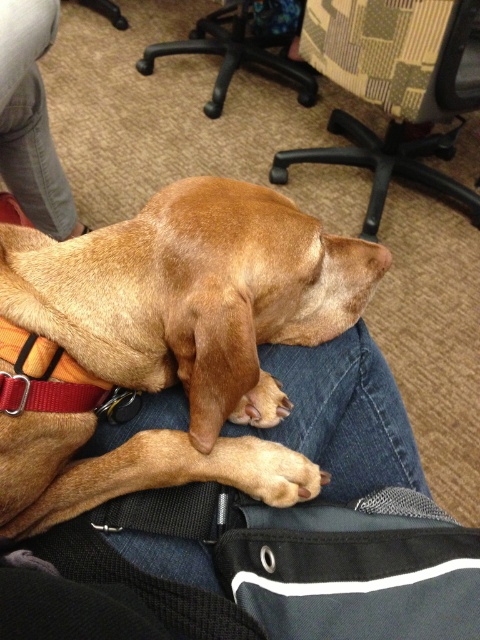
The height and width of the screenshot is (640, 480). Identify the location of patterned fabric chair at upper center. (393, 88).

Does patterned fabric chair at upper center have a lesser height compared to denim pants at lower left?

In fact, patterned fabric chair at upper center may be taller than denim pants at lower left.

Between point (436, 99) and point (23, 16), which one is positioned behind?

The point (436, 99) is more distant.

Locate an element on the screen. This screenshot has width=480, height=640. patterned fabric chair at upper center is located at coordinates (393, 88).

Is point (133, 472) positioned after point (50, 161)?

That is False.

Does brown fur dog at center have a greater height compared to denim pants at lower left?

Yes.

Measure the distance between point [266,305] and camera.

Point [266,305] is 24.54 inches from camera.

In order to click on brown fur dog at center in this screenshot , I will do `click(170, 342)`.

Can you confirm if denim pants at lower left is shorter than black plastic chair at upper center?

Yes, denim pants at lower left is shorter than black plastic chair at upper center.

Between denim pants at lower left and black plastic chair at upper center, which one has less height?

denim pants at lower left

Identify the location of denim pants at lower left. (31, 118).